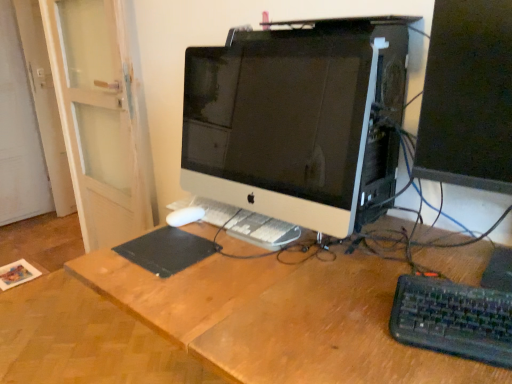
At what (x,y) coordinates should I click in order to perform the action: click on vacant space underneath black matte mousepad at center (from a real-world perspective). Please return your answer as a coordinate pair (x, y). Image resolution: width=512 pixels, height=384 pixels. Looking at the image, I should click on 170,248.